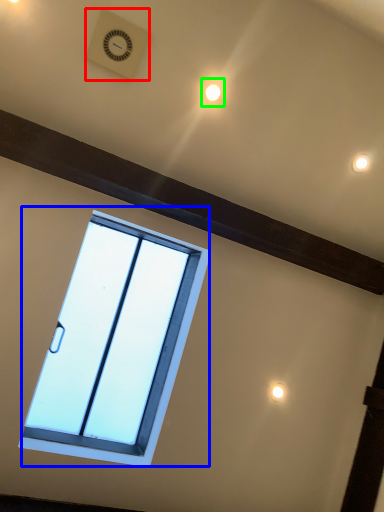
Question: Considering the real-world distances, which object is closest to clock (highlighted by a red box)? window (highlighted by a blue box) or light (highlighted by a green box).

Choices:
 (A) window
 (B) light

Answer: (B)